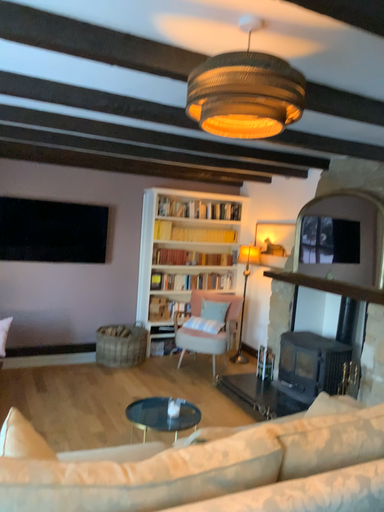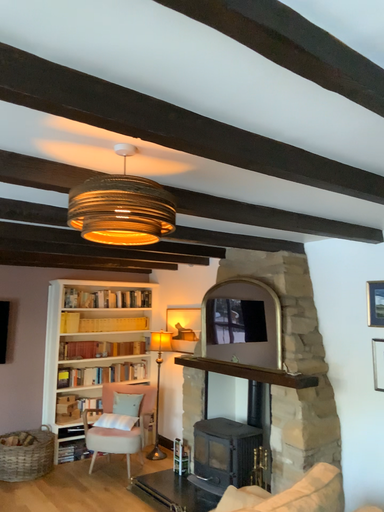
Question: How did the camera likely rotate when shooting the video?

Choices:
 (A) rotated right
 (B) rotated left

Answer: (A)